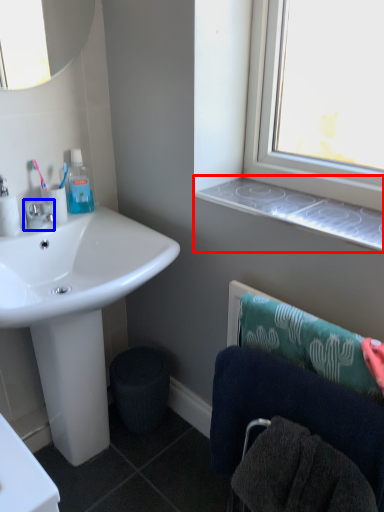
Question: Which object is further to the camera taking this photo, window sill (highlighted by a red box) or tap (highlighted by a blue box)?

Choices:
 (A) window sill
 (B) tap

Answer: (B)